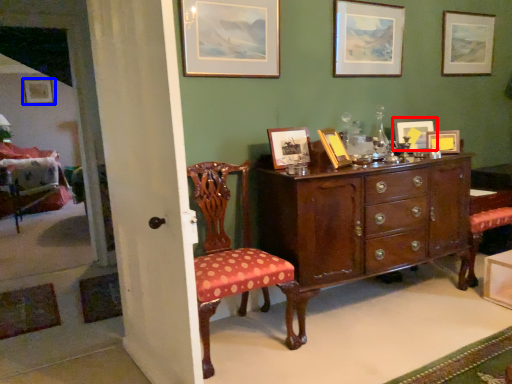
Question: Among these objects, which one is farthest to the camera, picture frame (highlighted by a red box) or picture frame (highlighted by a blue box)?

Choices:
 (A) picture frame
 (B) picture frame

Answer: (B)